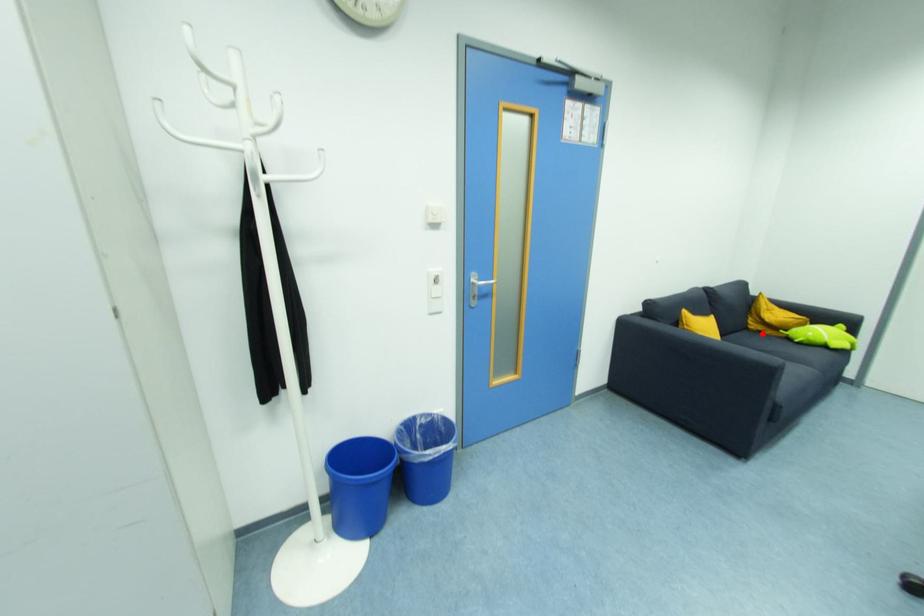
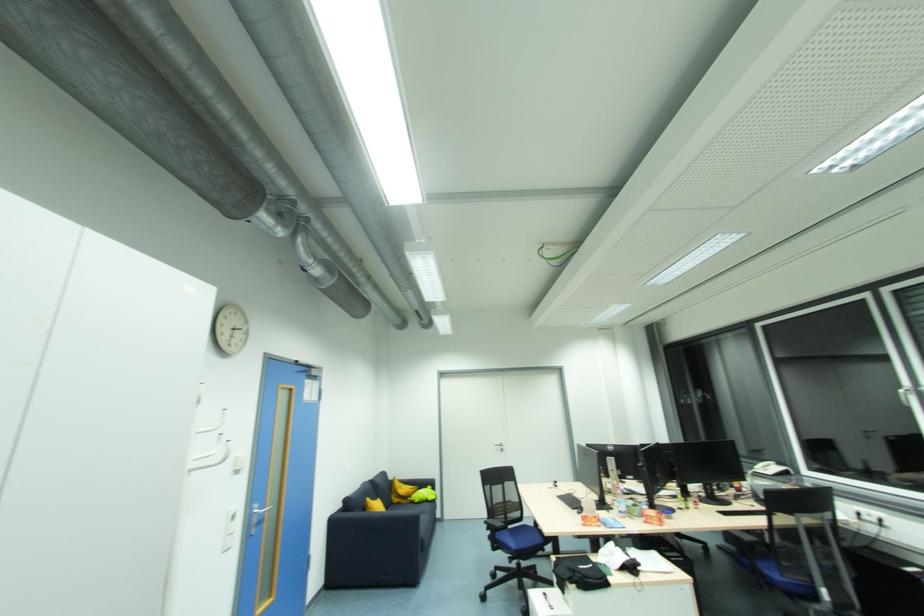
Question: A red point is marked in image1. In image2, is the corresponding 3D point closer to the camera or farther? Reply with the corresponding letter.

Choices:
 (A) The corresponding 3D point is closer.
 (B) The corresponding 3D point is farther.

Answer: (B)